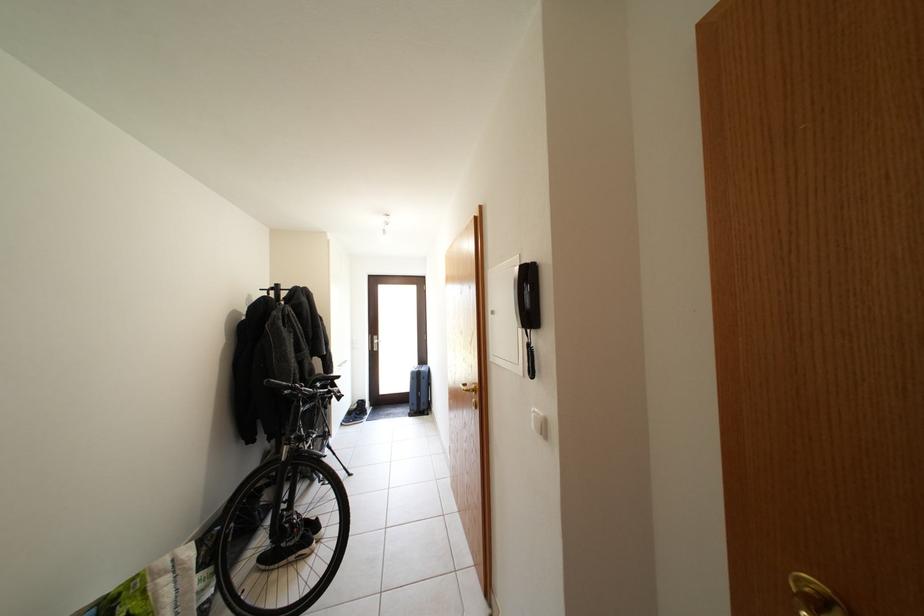
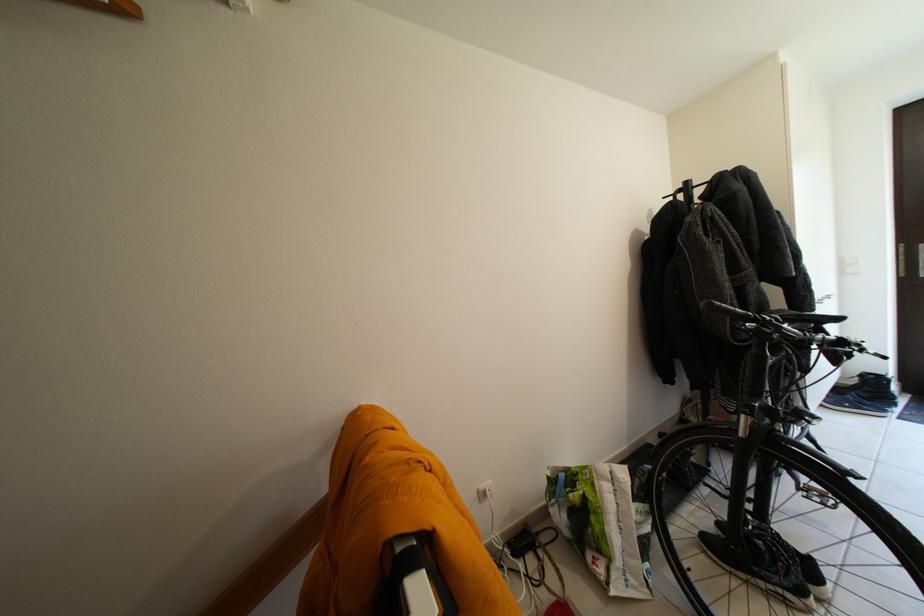
Locate, in the second image, the point that corresponds to point (286, 291) in the first image.

(696, 188)